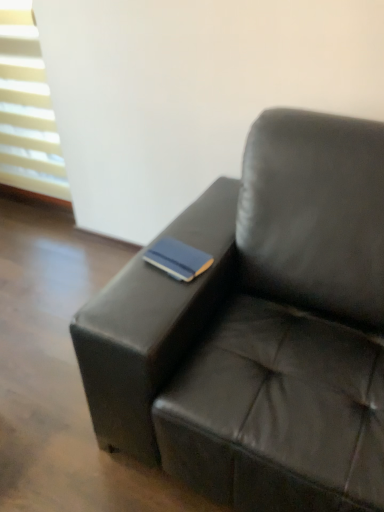
Question: Does black leather couch at center appear on the right side of white plastic blinds at upper left?

Choices:
 (A) no
 (B) yes

Answer: (B)

Question: Is the depth of black leather couch at center greater than that of white plastic blinds at upper left?

Choices:
 (A) yes
 (B) no

Answer: (B)

Question: From the image's perspective, would you say black leather couch at center is shown under white plastic blinds at upper left?

Choices:
 (A) no
 (B) yes

Answer: (B)

Question: Is white plastic blinds at upper left located within black leather couch at center?

Choices:
 (A) no
 (B) yes

Answer: (A)

Question: Is black leather couch at center completely or partially outside of white plastic blinds at upper left?

Choices:
 (A) yes
 (B) no

Answer: (A)

Question: Does black leather couch at center have a lesser width compared to white plastic blinds at upper left?

Choices:
 (A) no
 (B) yes

Answer: (A)

Question: From the image's perspective, would you say blue matte book at center is positioned over white plastic blinds at upper left?

Choices:
 (A) no
 (B) yes

Answer: (A)

Question: Considering the relative sizes of blue matte book at center and white plastic blinds at upper left in the image provided, is blue matte book at center thinner than white plastic blinds at upper left?

Choices:
 (A) yes
 (B) no

Answer: (A)

Question: Considering the relative sizes of blue matte book at center and white plastic blinds at upper left in the image provided, is blue matte book at center taller than white plastic blinds at upper left?

Choices:
 (A) yes
 (B) no

Answer: (B)

Question: Considering the relative positions of blue matte book at center and white plastic blinds at upper left in the image provided, is blue matte book at center to the right of white plastic blinds at upper left from the viewer's perspective?

Choices:
 (A) yes
 (B) no

Answer: (A)

Question: Is blue matte book at center shorter than white plastic blinds at upper left?

Choices:
 (A) yes
 (B) no

Answer: (A)

Question: From a real-world perspective, is blue matte book at center physically below white plastic blinds at upper left?

Choices:
 (A) no
 (B) yes

Answer: (B)

Question: Is black leather couch at center far away from blue matte book at center?

Choices:
 (A) no
 (B) yes

Answer: (A)